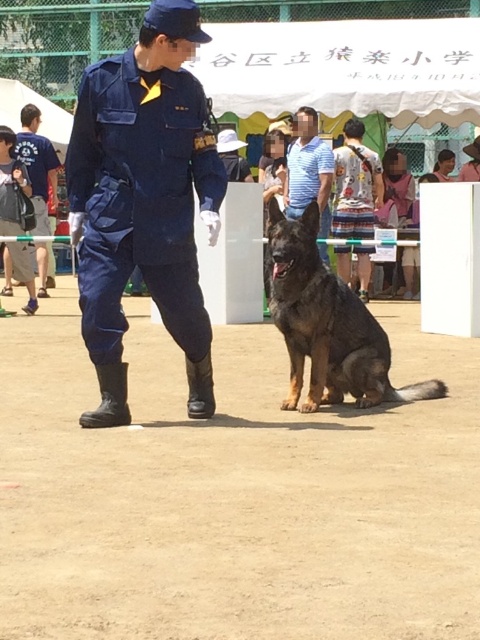
Question: Which point is closer to the camera?

Choices:
 (A) blue uniform at left
 (B) white cotton shirt at center
 (C) dark brown fur dog at center

Answer: (C)

Question: Can you confirm if dark brown fur dog at center is positioned to the left of white cotton shirt at center?

Choices:
 (A) no
 (B) yes

Answer: (B)

Question: Can you confirm if dark brown fur dog at center is smaller than striped cotton shirt at center?

Choices:
 (A) yes
 (B) no

Answer: (B)

Question: Which object appears closest to the camera in this image?

Choices:
 (A) matte blue uniform at center
 (B) white cotton shirt at center

Answer: (A)

Question: Which object is positioned closest to the striped cotton shirt at center?

Choices:
 (A) blue uniform at left
 (B) white cotton shirt at center
 (C) dirt field at center

Answer: (B)

Question: Can you confirm if dirt field at center is positioned to the left of matte blue uniform at center?

Choices:
 (A) no
 (B) yes

Answer: (A)